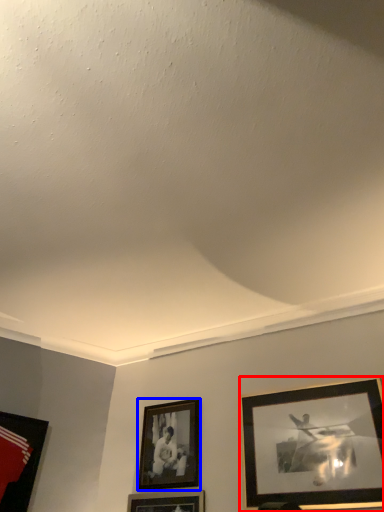
Question: Which of the following is the farthest to the observer, picture frame (highlighted by a red box) or picture frame (highlighted by a blue box)?

Choices:
 (A) picture frame
 (B) picture frame

Answer: (B)